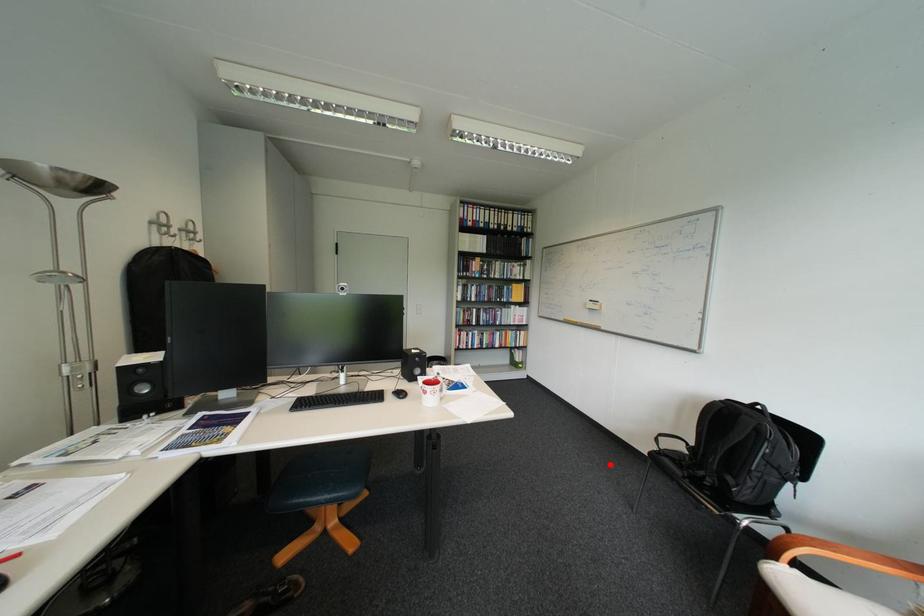
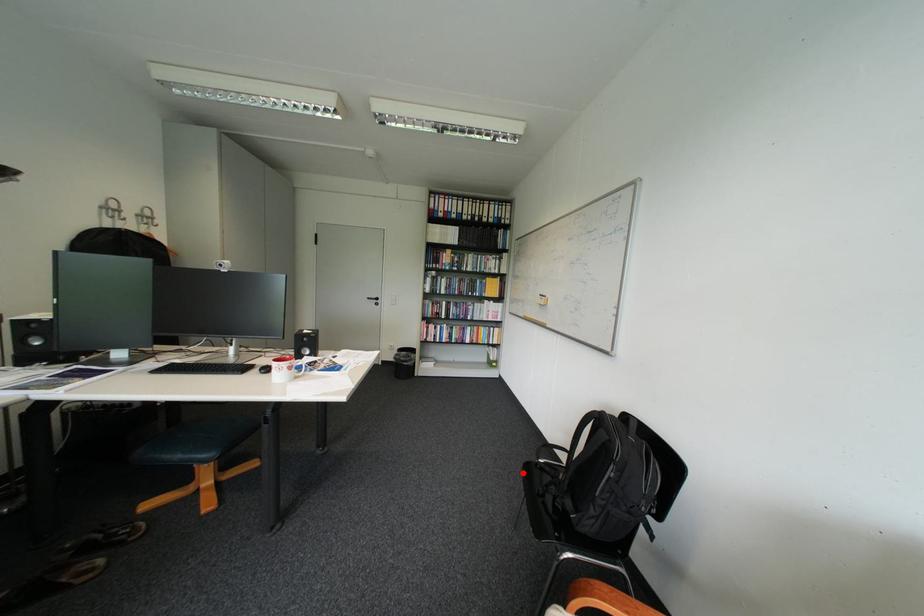
I am providing you with two images of the same scene from different viewpoints. A red point is marked on the first image and another point is marked on the second image. Do the highlighted points in image1 and image2 indicate the same real-world spot?

Yes